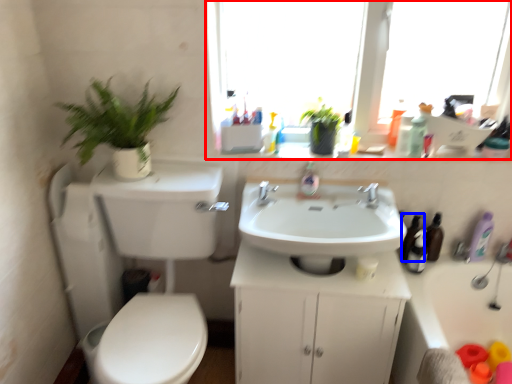
Question: Among these objects, which one is farthest to the camera, window (highlighted by a red box) or toiletry (highlighted by a blue box)?

Choices:
 (A) window
 (B) toiletry

Answer: (B)